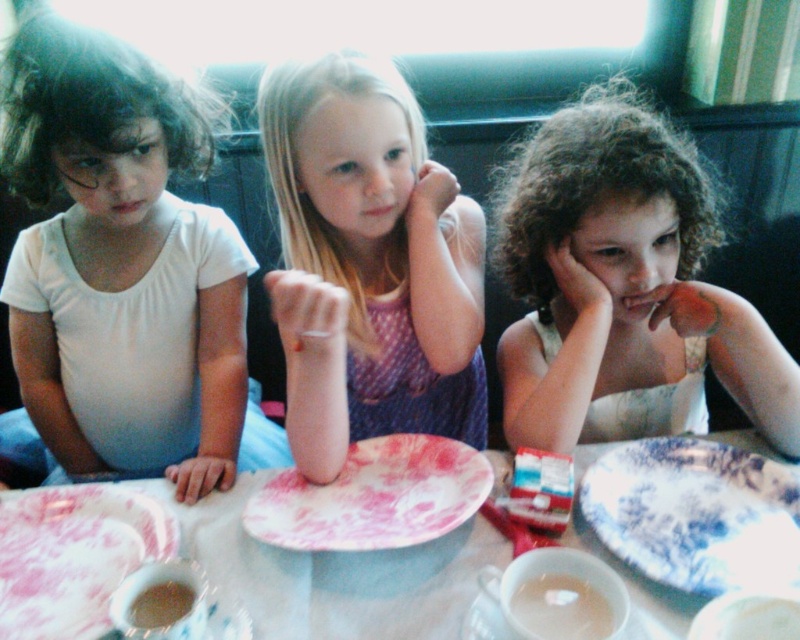
You are a waiter trying to deliver a drink to the child with curly hair at center. The drink is currently placed at the translucent glass cup at lower center. Which direction should you move the drink to reach the child?

The curly hair at center is to the right of the translucent glass cup at lower center, so you should move the drink to the right to reach the child.

You are a photographer trying to capture a candid shot of the children. You notice the pink fabric dress at center and the floral porcelain plate at center. Which object is closer to the left side of the table?

The pink fabric dress at center is positioned on the left side of the floral porcelain plate at center, so it is closer to the left side of the table.

You are a photographer trying to capture a closeup of the pink fabric dress at center. Based on the coordinates provided, where should you position your camera relative to the children?

The pink fabric dress at center is located at point (368, 262), so you should position your camera slightly to the left and lower down to focus on the dress at those coordinates.